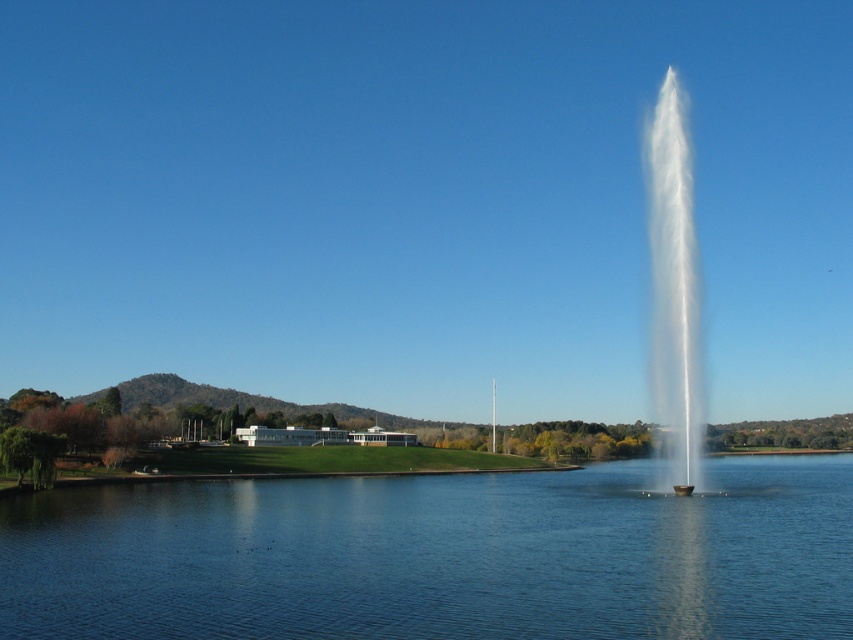
Between clear blue water at center and white frothy water at right, which one has more height?

Standing taller between the two is white frothy water at right.

Identify the location of clear blue water at center. The width and height of the screenshot is (853, 640). (439, 556).

Is point (489, 499) farther from viewer compared to point (695, 436)?

That is True.

Where is `clear blue water at center`? clear blue water at center is located at coordinates (439, 556).